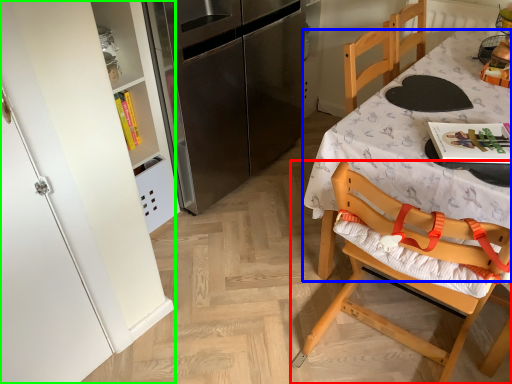
Question: Estimate the real-world distances between objects in this image. Which object is closer to chair (highlighted by a red box), desk (highlighted by a blue box) or cabinetry (highlighted by a green box)?

Choices:
 (A) desk
 (B) cabinetry

Answer: (A)